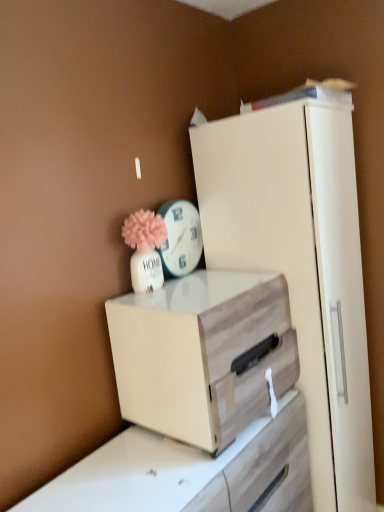
Locate an element on the screen. wooden chest of drawers at center is located at coordinates (201, 354).

The image size is (384, 512). What do you see at coordinates (201, 354) in the screenshot?
I see `wooden chest of drawers at center` at bounding box center [201, 354].

Identify the location of white glossy clock at upper center. This screenshot has width=384, height=512. (180, 238).

The height and width of the screenshot is (512, 384). Describe the element at coordinates (180, 238) in the screenshot. I see `white glossy clock at upper center` at that location.

Where is `wooden chest of drawers at center`? wooden chest of drawers at center is located at coordinates (201, 354).

Does wooden chest of drawers at center appear on the right side of white glossy clock at upper center?

Correct, you'll find wooden chest of drawers at center to the right of white glossy clock at upper center.

Considering the positions of objects wooden chest of drawers at center and white glossy clock at upper center in the image provided, who is behind, wooden chest of drawers at center or white glossy clock at upper center?

white glossy clock at upper center.

Is point (187, 420) closer or farther from the camera than point (178, 260)?

Point (187, 420) appears to be closer to the viewer than point (178, 260).

From the image's perspective, is wooden chest of drawers at center located beneath white glossy clock at upper center?

Indeed, from the image's perspective, wooden chest of drawers at center is shown beneath white glossy clock at upper center.

From a real-world perspective, is wooden chest of drawers at center on top of white glossy clock at upper center?

No.

Is wooden chest of drawers at center thinner than white glossy clock at upper center?

Incorrect, the width of wooden chest of drawers at center is not less than that of white glossy clock at upper center.

Considering the sizes of wooden chest of drawers at center and white glossy clock at upper center in the image, is wooden chest of drawers at center taller or shorter than white glossy clock at upper center?

wooden chest of drawers at center is taller than white glossy clock at upper center.

Who is bigger, wooden chest of drawers at center or white glossy clock at upper center?

Bigger between the two is wooden chest of drawers at center.

Is white glossy clock at upper center completely or partially inside wooden chest of drawers at center?

No, white glossy clock at upper center is not surrounded by wooden chest of drawers at center.

Would you say wooden chest of drawers at center is a long distance from white glossy clock at upper center?

They are positioned close to each other.

Is wooden chest of drawers at center turned away from white glossy clock at upper center?

No, wooden chest of drawers at center's orientation is not away from white glossy clock at upper center.

What's the angular difference between wooden chest of drawers at center and white glossy clock at upper center's facing directions?

The angle between the facing direction of wooden chest of drawers at center and the facing direction of white glossy clock at upper center is 1.85 degrees.

The height and width of the screenshot is (512, 384). I want to click on chest of drawers in front of the white glossy clock at upper center, so click(201, 354).

Looking at this image, can you confirm if white glossy clock at upper center is positioned to the left of wooden chest of drawers at center?

Yes.

Which object is closer to the camera taking this photo, white glossy clock at upper center or wooden chest of drawers at center?

wooden chest of drawers at center.

Considering the positions of point (163, 253) and point (116, 327), is point (163, 253) closer or farther from the camera than point (116, 327)?

Point (163, 253).

From the image's perspective, is white glossy clock at upper center on top of wooden chest of drawers at center?

Yes.

From a real-world perspective, is white glossy clock at upper center under wooden chest of drawers at center?

Actually, white glossy clock at upper center is physically above wooden chest of drawers at center in the real world.

Considering the sizes of white glossy clock at upper center and wooden chest of drawers at center in the image, is white glossy clock at upper center wider or thinner than wooden chest of drawers at center?

In the image, white glossy clock at upper center appears to be more narrow than wooden chest of drawers at center.

Consider the image. Considering the sizes of objects white glossy clock at upper center and wooden chest of drawers at center in the image provided, who is taller, white glossy clock at upper center or wooden chest of drawers at center?

Standing taller between the two is wooden chest of drawers at center.

Considering the sizes of white glossy clock at upper center and wooden chest of drawers at center in the image, is white glossy clock at upper center bigger or smaller than wooden chest of drawers at center?

white glossy clock at upper center is smaller than wooden chest of drawers at center.

Based on the photo, is white glossy clock at upper center inside the boundaries of wooden chest of drawers at center, or outside?

white glossy clock at upper center cannot be found inside wooden chest of drawers at center.

Is white glossy clock at upper center far away from wooden chest of drawers at center?

No, white glossy clock at upper center is not far away from wooden chest of drawers at center.

In the scene shown: Is white glossy clock at upper center looking in the opposite direction of wooden chest of drawers at center?

No, white glossy clock at upper center is not facing away from wooden chest of drawers at center.

From the picture: Can you tell me how much white glossy clock at upper center and wooden chest of drawers at center differ in facing direction?

white glossy clock at upper center and wooden chest of drawers at center are facing 1.85 degrees away from each other.

This screenshot has height=512, width=384. Identify the location of clock above the wooden chest of drawers at center (from the image's perspective). (180, 238).

I want to click on chest of drawers in front of the white glossy clock at upper center, so click(201, 354).

I want to click on the chest of drawers lying below the white glossy clock at upper center (from the image's perspective), so click(x=201, y=354).